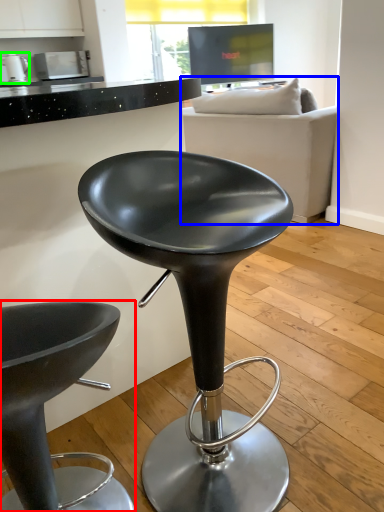
Question: Based on their relative distances, which object is nearer to chair (highlighted by a red box)? Choose from studio couch (highlighted by a blue box) and appliance (highlighted by a green box).

Choices:
 (A) studio couch
 (B) appliance

Answer: (A)